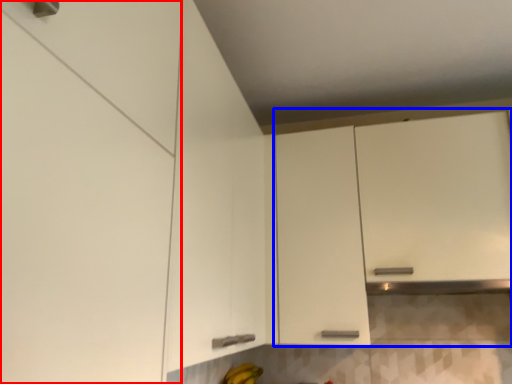
Question: Which object appears farthest to the camera in this image, cabinetry (highlighted by a red box) or cabinetry (highlighted by a blue box)?

Choices:
 (A) cabinetry
 (B) cabinetry

Answer: (B)